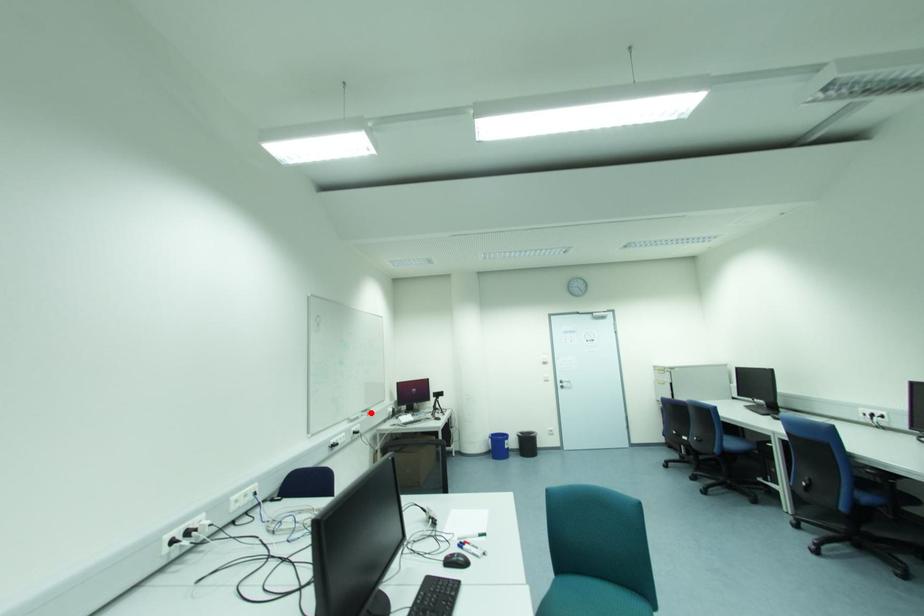
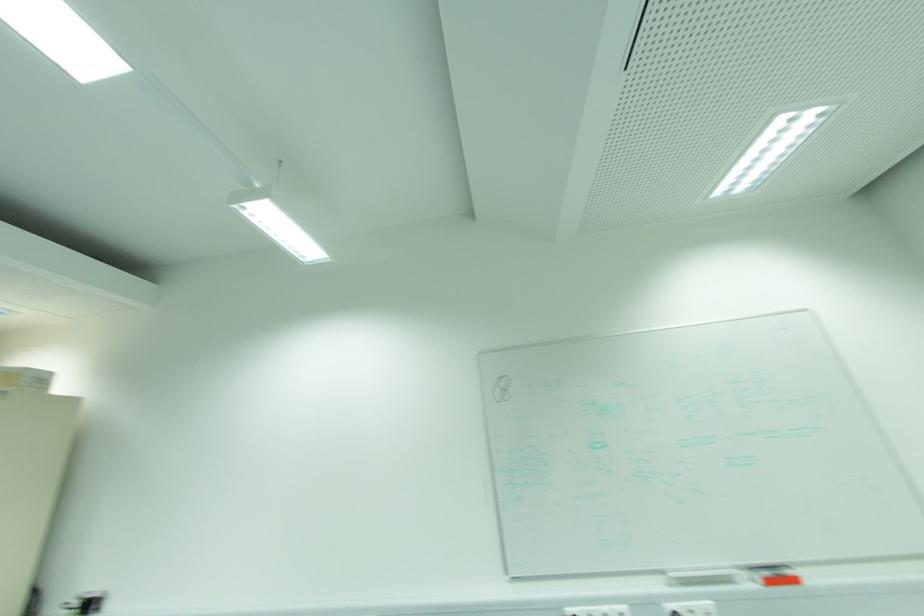
Question: I am providing you with two images of the same scene from different viewpoints. In image1, a red point is highlighted. Considering the same 3D point in image2, which of the following is correct?

Choices:
 (A) It is closer
 (B) It is farther

Answer: (A)